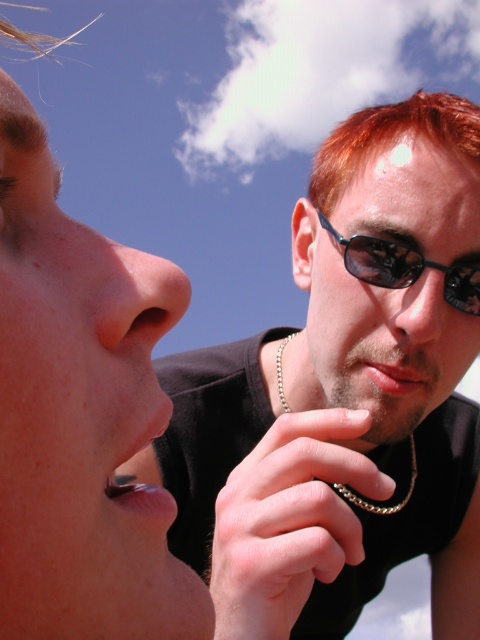
Is reddish hair at upper right shorter than matte black nose at center?

Incorrect, reddish hair at upper right's height does not fall short of matte black nose at center's.

Which of these two, reddish hair at upper right or matte black nose at center, stands shorter?

Standing shorter between the two is matte black nose at center.

Does point (411, 104) lie behind point (387, 314)?

Yes, point (411, 104) is farther from viewer.

Locate an element on the screen. The image size is (480, 640). reddish hair at upper right is located at coordinates (392, 138).

Does black plastic sunglasses at upper right have a lesser width compared to matte black nose at center?

No.

Who is more forward, (372, 272) or (447, 312)?

Point (372, 272)

Does point (411, 253) lie behind point (396, 294)?

No, (411, 253) is closer to viewer.

You are a GUI agent. You are given a task and a screenshot of the screen. Output one action in this format:
    pyautogui.click(x=<x>, y=<y>)
    Task: Click on the black plastic sunglasses at upper right
    This screenshot has width=480, height=640.
    Given the screenshot: What is the action you would take?
    point(405,268)

Is smooth skin hand at center to the right of black plastic sunglasses at upper right from the viewer's perspective?

No, smooth skin hand at center is not to the right of black plastic sunglasses at upper right.

Which is above, smooth skin hand at center or black plastic sunglasses at upper right?

black plastic sunglasses at upper right is higher up.

Is point (227, 602) in front of point (391, 256)?

Yes, point (227, 602) is closer to viewer.

Where is `smooth skin hand at center`? This screenshot has width=480, height=640. smooth skin hand at center is located at coordinates (288, 520).